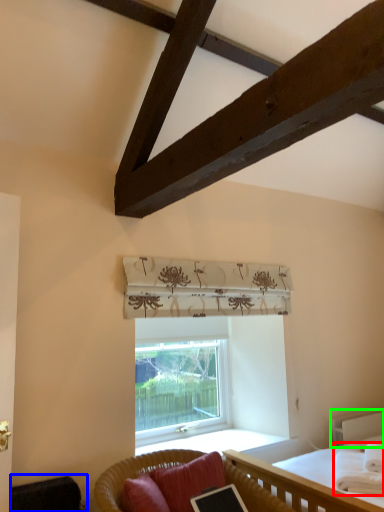
Question: Estimate the real-world distances between objects in this image. Which object is closer to blanket (highlighted by a red box), swivel chair (highlighted by a blue box) or balustrade (highlighted by a green box)?

Choices:
 (A) swivel chair
 (B) balustrade

Answer: (B)